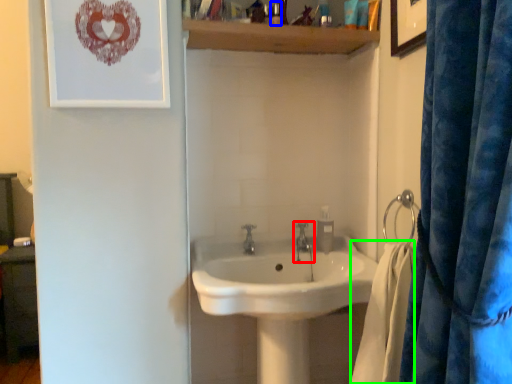
Question: Based on their relative distances, which object is farther from tap (highlighted by a red box)? Choose from toiletry (highlighted by a blue box) and bath towel (highlighted by a green box).

Choices:
 (A) toiletry
 (B) bath towel

Answer: (A)